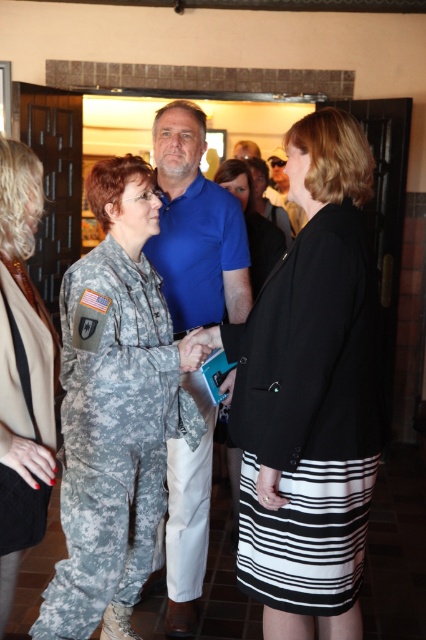
Between black matte blazer at center and camouflage fabric skirt at center, which one has less height?

camouflage fabric skirt at center is shorter.

The height and width of the screenshot is (640, 426). Identify the location of black matte blazer at center. (310, 396).

From the picture: Is camouflage fabric skirt at center bigger than black fabric jacket at center?

Actually, camouflage fabric skirt at center might be smaller than black fabric jacket at center.

Is the position of camouflage fabric skirt at center more distant than that of black fabric jacket at center?

No, camouflage fabric skirt at center is in front of black fabric jacket at center.

Which is behind, point (262, 584) or point (221, 170)?

Positioned behind is point (221, 170).

Image resolution: width=426 pixels, height=640 pixels. I want to click on camouflage fabric skirt at center, so click(x=305, y=536).

Measure the distance between blue smooth shirt at center and camouflage uniform at center.

The distance of blue smooth shirt at center from camouflage uniform at center is 38.14 inches.

Is blue smooth shirt at center to the right of camouflage uniform at center from the viewer's perspective?

Correct, you'll find blue smooth shirt at center to the right of camouflage uniform at center.

The width and height of the screenshot is (426, 640). Describe the element at coordinates (195, 227) in the screenshot. I see `blue smooth shirt at center` at that location.

At what (x,y) coordinates should I click in order to perform the action: click on blue smooth shirt at center. Please return your answer as a coordinate pair (x, y). Looking at the image, I should click on (195, 227).